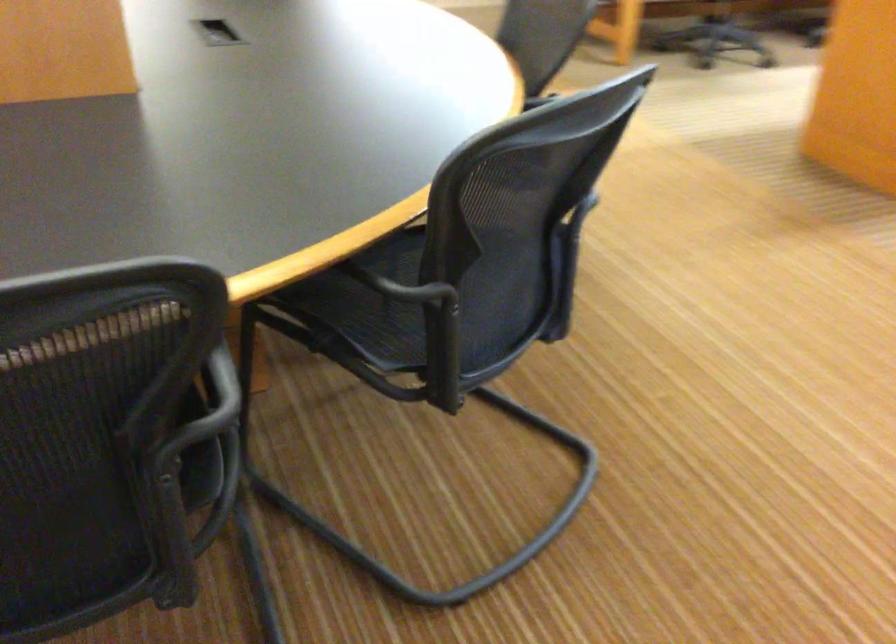
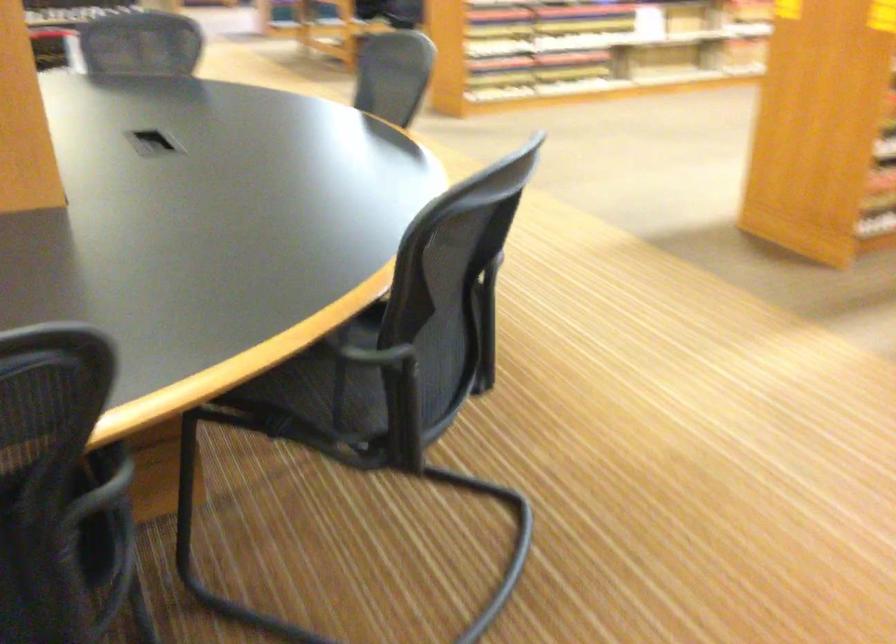
In the scene shown: In a continuous first-person perspective shot, in which direction is the camera moving?

The cameraman moved toward left, backward.